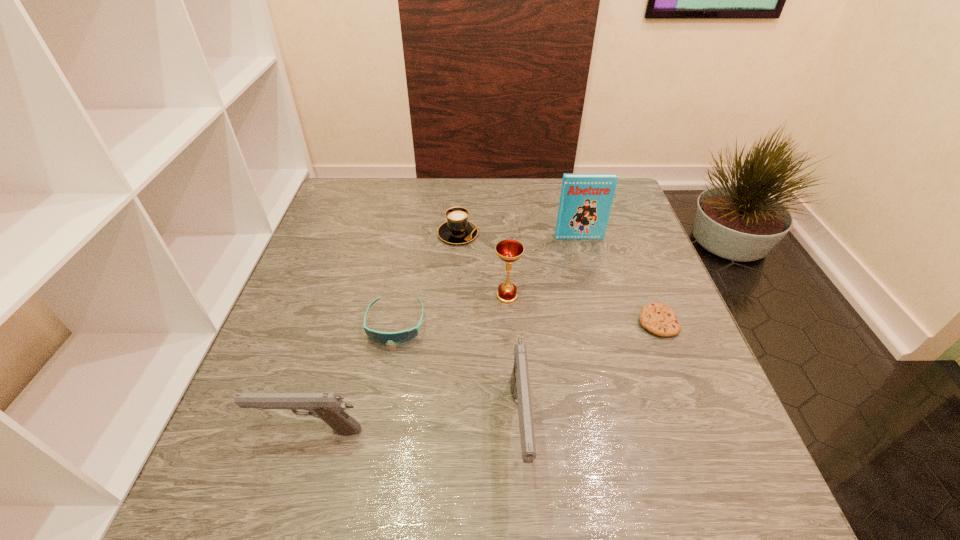
Locate an element on the screen. The width and height of the screenshot is (960, 540). object positioned at the near left corner is located at coordinates (329, 407).

The width and height of the screenshot is (960, 540). I want to click on vacant space at the far edge of the desktop, so click(x=390, y=209).

This screenshot has height=540, width=960. In the image, there is a desktop. Identify the location of vacant space at the near edge. (632, 429).

In the image, there is a desktop. Where is `vacant space at the left edge`? vacant space at the left edge is located at coordinates (345, 306).

At what (x,y) coordinates should I click in order to perform the action: click on vacant area at the right edge. Please return your answer as a coordinate pair (x, y). Looking at the image, I should click on (667, 368).

This screenshot has width=960, height=540. In the image, there is a desktop. Identify the location of free space at the far left corner. (381, 182).

The width and height of the screenshot is (960, 540). I want to click on blank region between the chalice and the fifth object from right to left, so click(x=483, y=265).

The width and height of the screenshot is (960, 540). I want to click on blank region between the second object from right to left and the shortest object, so [x=618, y=280].

Locate an element on the screen. free space between the tallest object and the shorter pistol is located at coordinates (444, 334).

Locate an element on the screen. The image size is (960, 540). vacant point located between the third shortest object and the taller pistol is located at coordinates (489, 331).